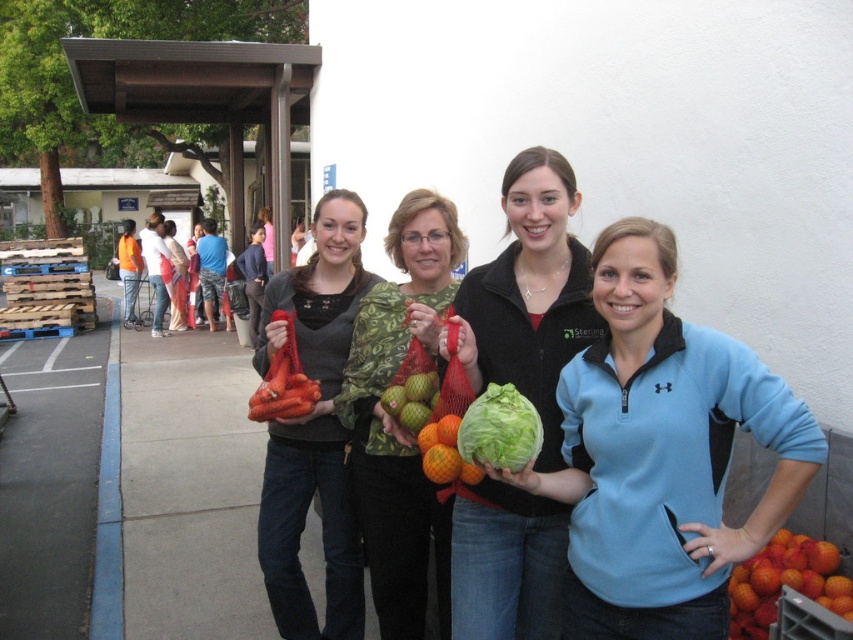
Does orange matte/orange at lower right appear over green leafy cabbage at center?

No, orange matte/orange at lower right is not above green leafy cabbage at center.

In order to click on orange matte/orange at lower right in this screenshot , I will do `click(785, 582)`.

Between green leafy lettuce at center and green leafy cabbage at center, which one is positioned lower?

green leafy cabbage at center is lower down.

Is green leafy lettuce at center to the right of green leafy cabbage at center from the viewer's perspective?

Indeed, green leafy lettuce at center is positioned on the right side of green leafy cabbage at center.

Where is `green leafy lettuce at center`? This screenshot has width=853, height=640. green leafy lettuce at center is located at coordinates (531, 294).

In the scene shown: Does light blue fleece jacket at center appear on the right side of matte orange carrots at center?

Yes, light blue fleece jacket at center is to the right of matte orange carrots at center.

Does light blue fleece jacket at center appear under matte orange carrots at center?

Incorrect, light blue fleece jacket at center is not positioned below matte orange carrots at center.

In order to click on light blue fleece jacket at center in this screenshot , I will do `click(660, 452)`.

At what (x,y) coordinates should I click in order to perform the action: click on light blue fleece jacket at center. Please return your answer as a coordinate pair (x, y). The image size is (853, 640). Looking at the image, I should click on (660, 452).